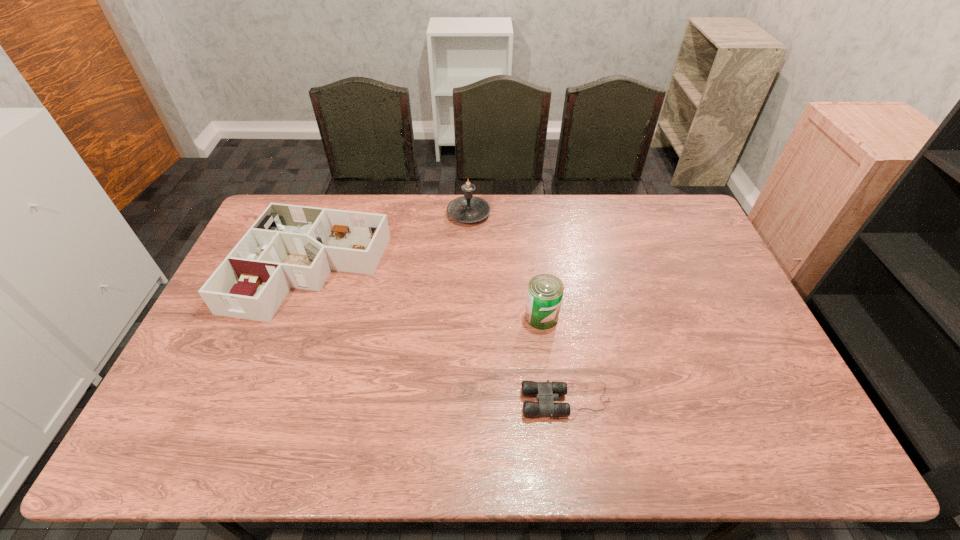
I want to click on free space located at the eyepiece of the shortest object, so click(x=439, y=401).

You are a GUI agent. You are given a task and a screenshot of the screen. Output one action in this format:
    pyautogui.click(x=<x>, y=<y>)
    Task: Click on the blank area located 0.280m at the eyepiece of the shortest object
    
    Given the screenshot: What is the action you would take?
    pyautogui.click(x=412, y=401)

The width and height of the screenshot is (960, 540). What are the coordinates of `free space located at the eyepiece of the shortest object` in the screenshot? It's located at (443, 401).

Identify the location of candle that is at the far edge. (468, 208).

Locate an element on the screen. dollhouse present at the far edge is located at coordinates (289, 246).

In order to click on object present at the left edge in this screenshot , I will do `click(289, 246)`.

Find the location of a particular element. The height and width of the screenshot is (540, 960). object that is positioned at the far left corner is located at coordinates (289, 246).

In order to click on vacant position at the far edge of the desktop in this screenshot , I will do `click(495, 200)`.

Locate an element on the screen. The width and height of the screenshot is (960, 540). free space at the right edge is located at coordinates (708, 309).

Locate an element on the screen. free space at the far right corner of the desktop is located at coordinates (699, 228).